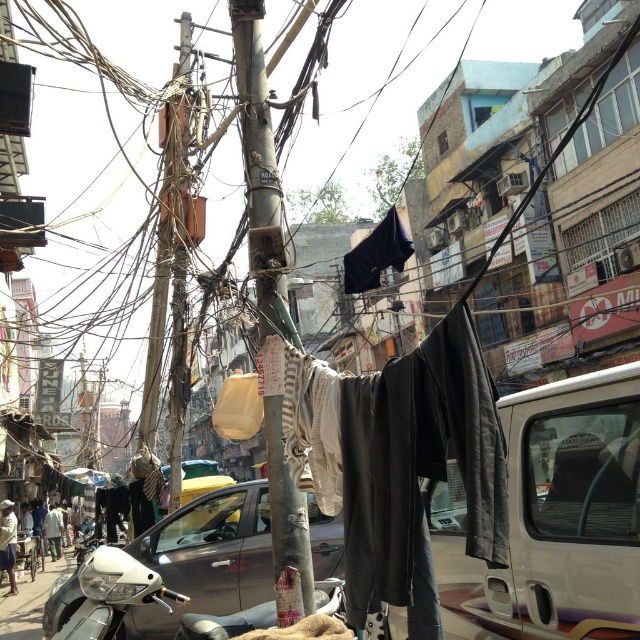
Question: Which object is positioned closest to the dark blue jeans at lower left?

Choices:
 (A) dark gray fabric at center
 (B) light brown fabric at lower left

Answer: (B)

Question: Can you confirm if metallic gray car at center is smaller than light brown fabric at lower left?

Choices:
 (A) yes
 (B) no

Answer: (B)

Question: Observing the image, what is the correct spatial positioning of rusty metal pole at center in reference to light brown fabric at lower left?

Choices:
 (A) left
 (B) right

Answer: (B)

Question: Is rusty metal pole at center positioned behind light brown fabric at lower left?

Choices:
 (A) yes
 (B) no

Answer: (B)

Question: Which of these objects is positioned farthest from the dark gray fabric at center?

Choices:
 (A) metallic gray car at center
 (B) rusty metal pole at center

Answer: (A)

Question: Which is nearer to the light brown fabric at lower left?

Choices:
 (A) dark blue jeans at lower left
 (B) rusty metal pole at center
 (C) metallic gray car at center

Answer: (A)